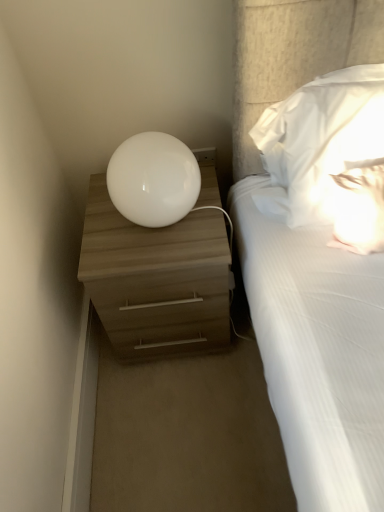
Locate an element on the screen. The height and width of the screenshot is (512, 384). vacant space to the left of white glossy sphere at upper center is located at coordinates (98, 228).